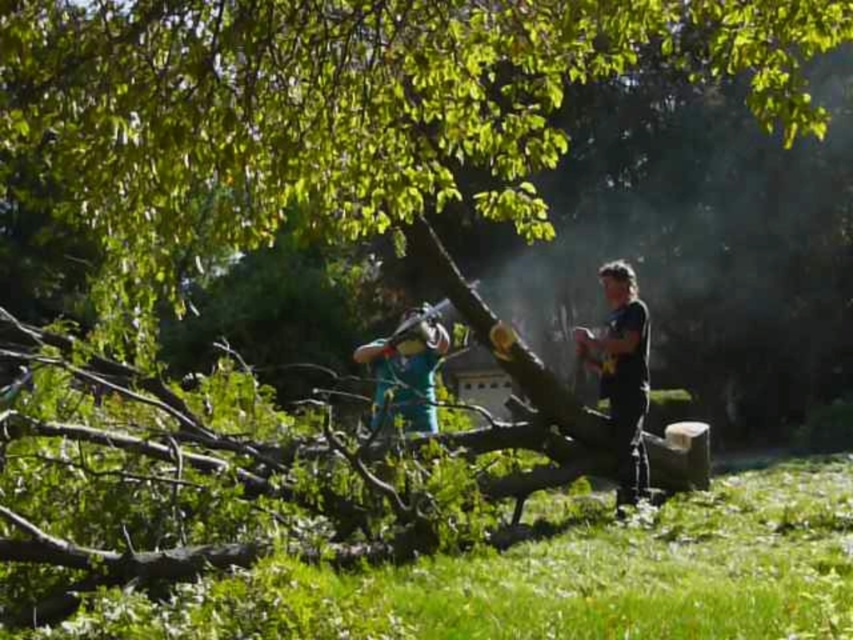
Question: Can you confirm if black matte shirt at right is thinner than green matte shirt at center?

Choices:
 (A) yes
 (B) no

Answer: (A)

Question: Does black matte shirt at right have a larger size compared to green matte shirt at center?

Choices:
 (A) yes
 (B) no

Answer: (B)

Question: Which of the following is the farthest from the observer?

Choices:
 (A) green matte shirt at center
 (B) black matte shirt at right

Answer: (A)

Question: Considering the relative positions of black matte shirt at right and green matte shirt at center in the image provided, where is black matte shirt at right located with respect to green matte shirt at center?

Choices:
 (A) left
 (B) right

Answer: (B)